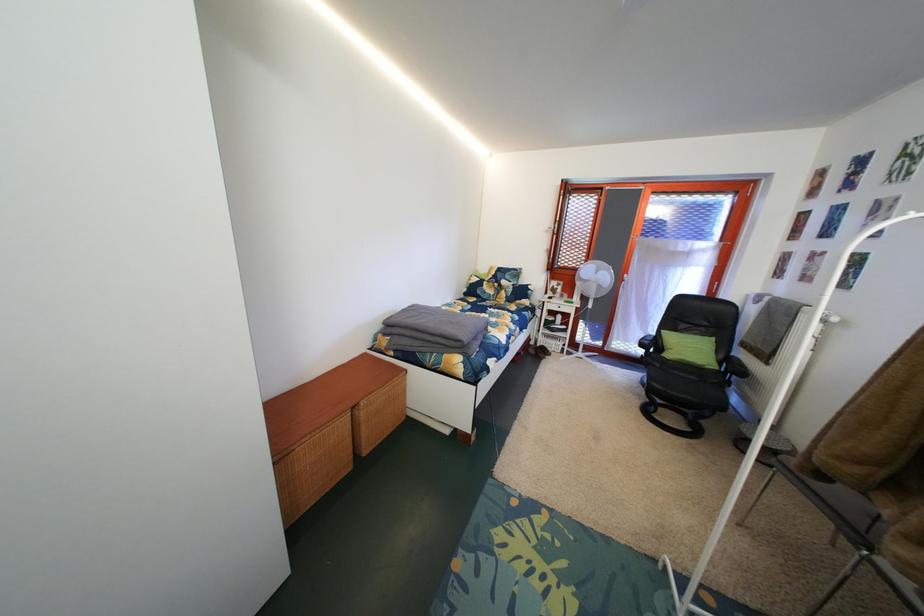
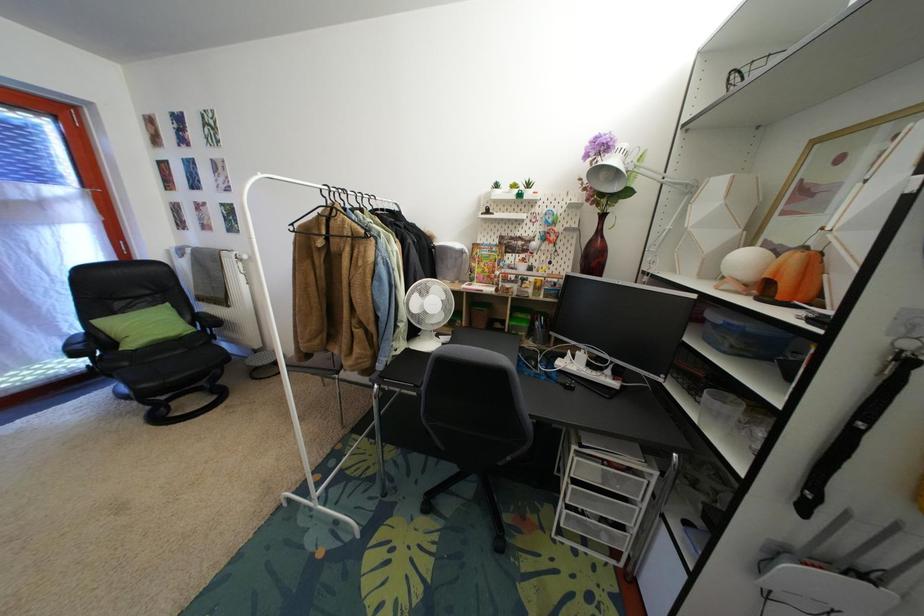
The images are taken continuously from a first-person perspective. In which direction is your viewpoint rotating?

The camera's rotation is toward right-down.